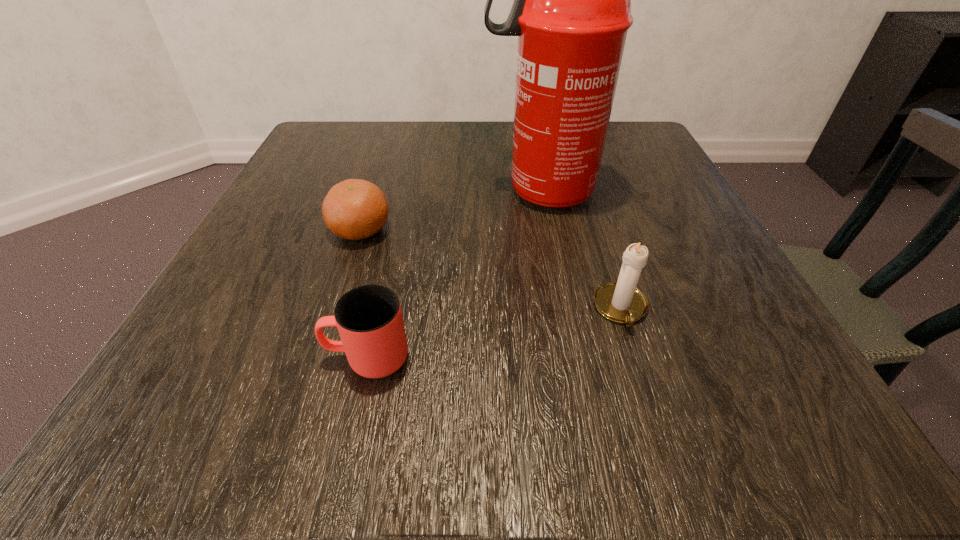
You are a GUI agent. You are given a task and a screenshot of the screen. Output one action in this format:
    pyautogui.click(x=<x>, y=<y>)
    Task: Click on the vacant region at the far left corner of the desktop
    Image resolution: width=960 pixels, height=540 pixels.
    Given the screenshot: What is the action you would take?
    pyautogui.click(x=316, y=161)

I want to click on vacant area that lies between the second tallest object and the nearest object, so click(493, 333).

This screenshot has width=960, height=540. Find the location of `empty location between the fire extinguisher and the clementine`. empty location between the fire extinguisher and the clementine is located at coordinates click(450, 211).

I want to click on free space between the clementine and the second nearest object, so click(491, 269).

Find the location of `vacant space that is in between the tallest object and the candle holder`. vacant space that is in between the tallest object and the candle holder is located at coordinates (581, 250).

Locate an element on the screen. free space between the fire extinguisher and the clementine is located at coordinates (450, 211).

This screenshot has height=540, width=960. Find the location of `vacant area that lies between the candle holder and the tallest object`. vacant area that lies between the candle holder and the tallest object is located at coordinates (581, 250).

Locate an element on the screen. The height and width of the screenshot is (540, 960). vacant point located between the nearest object and the candle holder is located at coordinates (493, 333).

The image size is (960, 540). In order to click on free space between the clementine and the fire extinguisher in this screenshot , I will do `click(450, 211)`.

This screenshot has height=540, width=960. In order to click on object that is the closest to the tallest object in this screenshot , I will do `click(354, 209)`.